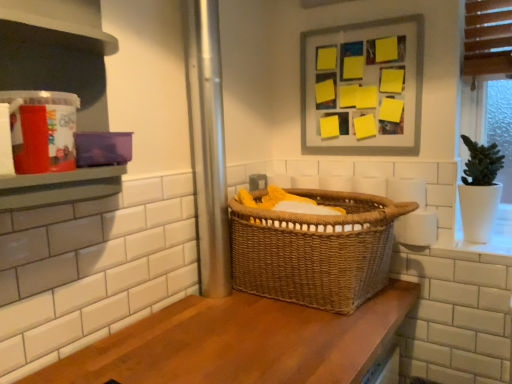
Describe the element at coordinates (417, 228) in the screenshot. I see `white matte toilet paper at right, positioned as the 2th toilet paper in top-to-bottom order` at that location.

Image resolution: width=512 pixels, height=384 pixels. What are the coordinates of `white matte toilet paper at right, which appears as the 1th toilet paper when ordered from the bottom` in the screenshot? It's located at (417, 228).

What is the approximate width of woven brown basket at center?

The width of woven brown basket at center is 17.34 inches.

This screenshot has height=384, width=512. I want to click on yellow paper at upper center, so click(364, 86).

From the image's perspective, is wooden counter at center under white matte toilet paper at right, which is the first toilet paper in top-to-bottom order?

Yes, from the image's perspective, wooden counter at center is below white matte toilet paper at right, which is the first toilet paper in top-to-bottom order.

Is wooden counter at center shorter than white matte toilet paper at right, positioned as the 2th toilet paper in bottom-to-top order?

Correct, wooden counter at center is not as tall as white matte toilet paper at right, positioned as the 2th toilet paper in bottom-to-top order.

Which of these two, wooden counter at center or white matte toilet paper at right, which is the first toilet paper in top-to-bottom order, is wider?

wooden counter at center.

Consider the image. Is wooden counter at center not close to white matte toilet paper at right, which is the first toilet paper in top-to-bottom order?

No, wooden counter at center is not far from white matte toilet paper at right, which is the first toilet paper in top-to-bottom order.

In the image, is white matte toilet paper at right, which is the first toilet paper in top-to-bottom order, positioned in front of or behind white matte toilet paper at right, positioned as the 2th toilet paper in top-to-bottom order?

Visually, white matte toilet paper at right, which is the first toilet paper in top-to-bottom order, is located behind white matte toilet paper at right, positioned as the 2th toilet paper in top-to-bottom order.

Is white matte toilet paper at right, positioned as the 2th toilet paper in bottom-to-top order, inside the boundaries of white matte toilet paper at right, positioned as the 2th toilet paper in top-to-bottom order, or outside?

white matte toilet paper at right, positioned as the 2th toilet paper in bottom-to-top order, cannot be found inside white matte toilet paper at right, positioned as the 2th toilet paper in top-to-bottom order.

Is white matte toilet paper at right, positioned as the 2th toilet paper in bottom-to-top order, oriented away from white matte toilet paper at right, positioned as the 2th toilet paper in top-to-bottom order?

white matte toilet paper at right, positioned as the 2th toilet paper in bottom-to-top order, is not turned away from white matte toilet paper at right, positioned as the 2th toilet paper in top-to-bottom order.

Is white matte toilet paper at right, which is the first toilet paper in top-to-bottom order, placed right next to white matte toilet paper at right, positioned as the 2th toilet paper in top-to-bottom order?

Yes, white matte toilet paper at right, which is the first toilet paper in top-to-bottom order, is with white matte toilet paper at right, positioned as the 2th toilet paper in top-to-bottom order.

From a real-world perspective, is yellow paper at upper center physically located above or below white matte toilet paper at right, which is the first toilet paper in top-to-bottom order?

yellow paper at upper center is situated higher than white matte toilet paper at right, which is the first toilet paper in top-to-bottom order, in the real world.

Would you say yellow paper at upper center is inside or outside white matte toilet paper at right, positioned as the 2th toilet paper in bottom-to-top order?

yellow paper at upper center is not enclosed by white matte toilet paper at right, positioned as the 2th toilet paper in bottom-to-top order.

Is yellow paper at upper center placed right next to white matte toilet paper at right, positioned as the 2th toilet paper in bottom-to-top order?

yellow paper at upper center is not next to white matte toilet paper at right, positioned as the 2th toilet paper in bottom-to-top order, and they're not touching.

Is the depth of yellow paper at upper center greater than that of white matte toilet paper at right, positioned as the 2th toilet paper in bottom-to-top order?

Yes, it is.

Can you tell me how much wooden counter at center and woven brown basket at center differ in facing direction?

wooden counter at center and woven brown basket at center are facing 90 degrees away from each other.

How much distance is there between wooden counter at center and woven brown basket at center?

wooden counter at center is 7.87 inches away from woven brown basket at center.

From a real-world perspective, which is physically below, wooden counter at center or woven brown basket at center?

From a 3D spatial view, wooden counter at center is below.

Considering the relative positions of wooden counter at center and woven brown basket at center in the image provided, is wooden counter at center to the left or to the right of woven brown basket at center?

From the image, it's evident that wooden counter at center is to the left of woven brown basket at center.

From a real-world perspective, is yellow paper at upper center physically located above or below matte plastic container at left?

yellow paper at upper center is situated higher than matte plastic container at left in the real world.

How much distance is there between yellow paper at upper center and matte plastic container at left?

yellow paper at upper center is 38.49 inches away from matte plastic container at left.

From the image's perspective, is yellow paper at upper center below matte plastic container at left?

Incorrect, from the image's perspective, yellow paper at upper center is higher than matte plastic container at left.

From the picture: Is yellow paper at upper center wider than matte plastic container at left?

In fact, yellow paper at upper center might be narrower than matte plastic container at left.

Is matte plastic container at left completely or partially inside white matte toilet paper at right, which appears as the 1th toilet paper when ordered from the bottom?

No, matte plastic container at left is not inside white matte toilet paper at right, which appears as the 1th toilet paper when ordered from the bottom.

Is white matte toilet paper at right, which appears as the 1th toilet paper when ordered from the bottom, shorter than matte plastic container at left?

Indeed, white matte toilet paper at right, which appears as the 1th toilet paper when ordered from the bottom, has a lesser height compared to matte plastic container at left.

Which is more to the left, white matte toilet paper at right, positioned as the 2th toilet paper in top-to-bottom order, or matte plastic container at left?

matte plastic container at left.

Which of these two, white matte toilet paper at right, positioned as the 2th toilet paper in top-to-bottom order, or matte plastic container at left, is wider?

Wider between the two is matte plastic container at left.

Can you see woven brown basket at center touching wooden counter at center?

There is a gap between woven brown basket at center and wooden counter at center.

Based on their sizes in the image, would you say woven brown basket at center is bigger or smaller than wooden counter at center?

Clearly, woven brown basket at center is larger in size than wooden counter at center.

From a real-world perspective, is woven brown basket at center positioned over wooden counter at center based on gravity?

Yes, from a real-world perspective, woven brown basket at center is above wooden counter at center.

Locate an element on the screen. The width and height of the screenshot is (512, 384). counter below the white matte toilet paper at right, positioned as the 2th toilet paper in bottom-to-top order (from a real-world perspective) is located at coordinates (241, 343).

Find the location of a particular element. This screenshot has height=384, width=512. toilet paper on the right of white matte toilet paper at right, positioned as the 2th toilet paper in bottom-to-top order is located at coordinates click(x=417, y=228).

Looking at the image, which one is located further to matte plastic container at left, white matte toilet paper at right, positioned as the 2th toilet paper in bottom-to-top order, or white matte toilet paper at right, positioned as the 2th toilet paper in top-to-bottom order?

white matte toilet paper at right, positioned as the 2th toilet paper in top-to-bottom order, lies further to matte plastic container at left than the other object.

Looking at the image, which one is located closer to woven brown basket at center, wooden counter at center or matte plastic container at left?

wooden counter at center.

Estimate the real-world distances between objects in this image. Which object is closer to yellow paper at upper center, wooden counter at center or white matte toilet paper at right, which appears as the 1th toilet paper when ordered from the bottom?

white matte toilet paper at right, which appears as the 1th toilet paper when ordered from the bottom, lies closer to yellow paper at upper center than the other object.

Which object lies further to the anchor point white matte toilet paper at right, positioned as the 2th toilet paper in top-to-bottom order, white matte toilet paper at right, positioned as the 2th toilet paper in bottom-to-top order, or wooden counter at center?

wooden counter at center.

Considering their positions, is white matte toilet paper at right, positioned as the 2th toilet paper in bottom-to-top order, positioned closer to white matte toilet paper at right, which appears as the 1th toilet paper when ordered from the bottom, than matte plastic container at left?

white matte toilet paper at right, positioned as the 2th toilet paper in bottom-to-top order, is positioned closer to the anchor white matte toilet paper at right, which appears as the 1th toilet paper when ordered from the bottom.

From the image, which object appears to be farther from wooden counter at center, woven brown basket at center or matte plastic container at left?

The object further to wooden counter at center is matte plastic container at left.

From the image, which object appears to be farther from yellow paper at upper center, white matte toilet paper at right, positioned as the 2th toilet paper in top-to-bottom order, or wooden counter at center?

wooden counter at center.

Which object lies nearer to the anchor point yellow paper at upper center, matte plastic container at left or woven brown basket at center?

woven brown basket at center is positioned closer to the anchor yellow paper at upper center.

Where is `basket located between wooden counter at center and white matte toilet paper at right, which is the first toilet paper in top-to-bottom order, in the depth direction`? This screenshot has height=384, width=512. basket located between wooden counter at center and white matte toilet paper at right, which is the first toilet paper in top-to-bottom order, in the depth direction is located at coordinates (316, 250).

I want to click on toilet paper between wooden counter at center and white matte toilet paper at right, which is the first toilet paper in top-to-bottom order, in the front-back direction, so click(417, 228).

What are the coordinates of `basket positioned between wooden counter at center and yellow paper at upper center from near to far` in the screenshot? It's located at (316, 250).

You are a GUI agent. You are given a task and a screenshot of the screen. Output one action in this format:
    pyautogui.click(x=<x>, y=<y>)
    Task: Click on the picture frame situated between matte plastic container at left and white matte toilet paper at right, positioned as the 2th toilet paper in bottom-to-top order, from left to right
    The height and width of the screenshot is (384, 512).
    Given the screenshot: What is the action you would take?
    pyautogui.click(x=364, y=86)